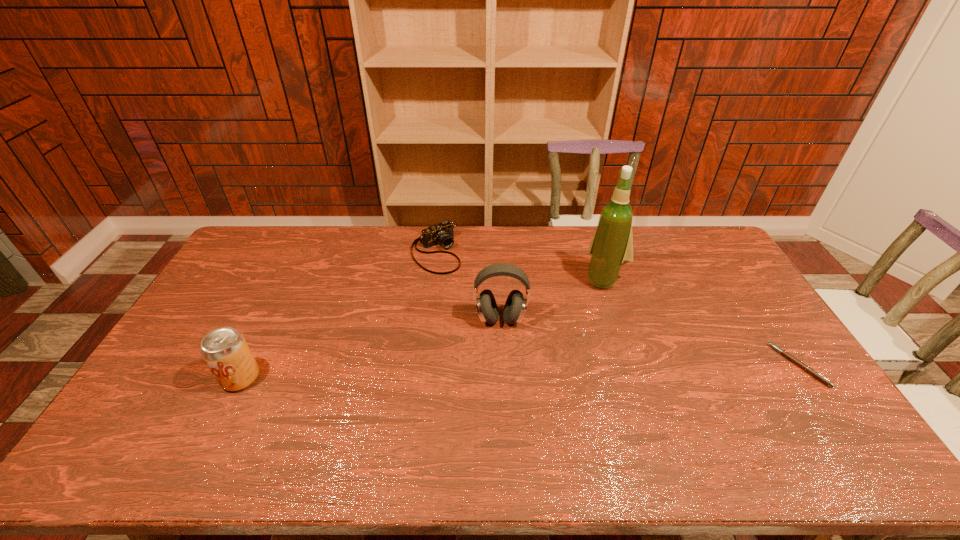
This screenshot has width=960, height=540. I want to click on the leftmost object, so click(225, 351).

This screenshot has width=960, height=540. I want to click on the third tallest object, so click(225, 351).

You are a GUI agent. You are given a task and a screenshot of the screen. Output one action in this format:
    pyautogui.click(x=<x>, y=<y>)
    Task: Click on the shortest object
    The width and height of the screenshot is (960, 540).
    Given the screenshot: What is the action you would take?
    pyautogui.click(x=808, y=369)

At what (x,y) coordinates should I click in order to perform the action: click on the rightmost object. Please return your answer as a coordinate pair (x, y). This screenshot has height=540, width=960. Looking at the image, I should click on (808, 369).

Image resolution: width=960 pixels, height=540 pixels. I want to click on wine bottle, so (x=612, y=245).

At what (x,y) coordinates should I click in order to perform the action: click on the tallest object. Please return your answer as a coordinate pair (x, y). This screenshot has width=960, height=540. Looking at the image, I should click on (612, 245).

I want to click on the fourth object from right to left, so click(442, 233).

Identify the location of camera. This screenshot has width=960, height=540. (442, 233).

Find the location of a particular element. This screenshot has height=540, width=960. the third nearest object is located at coordinates (516, 304).

At what (x,y) coordinates should I click in order to perform the action: click on headset. Please return your answer as a coordinate pair (x, y). The image size is (960, 540). Looking at the image, I should click on (516, 304).